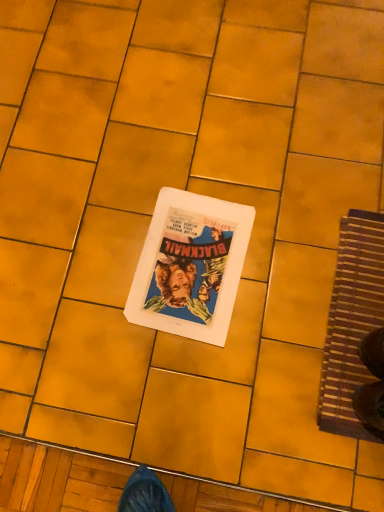
Where is `free point above white paper at center (from a real-world perspective)`? Image resolution: width=384 pixels, height=512 pixels. free point above white paper at center (from a real-world perspective) is located at coordinates (190, 261).